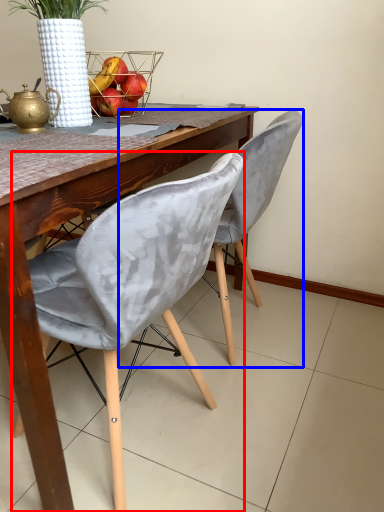
Question: Among these objects, which one is farthest to the camera, chair (highlighted by a red box) or chair (highlighted by a blue box)?

Choices:
 (A) chair
 (B) chair

Answer: (B)